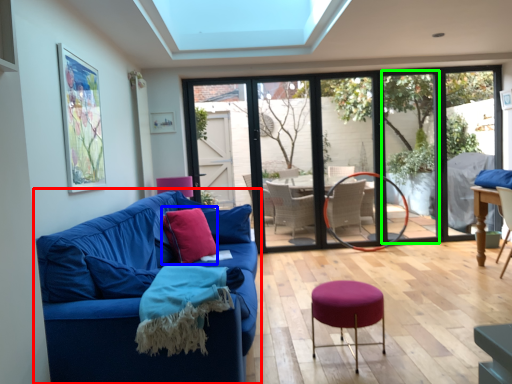
Question: Which is nearer to the studio couch (highlighted by a red box)? throw pillow (highlighted by a blue box) or window screen (highlighted by a green box).

Choices:
 (A) throw pillow
 (B) window screen

Answer: (A)